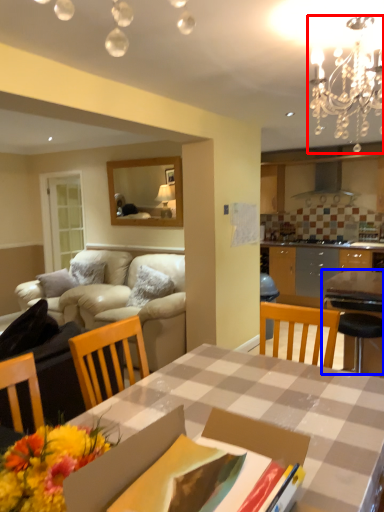
Question: Among these objects, which one is nearest to the camera, light fixture (highlighted by a red box) or table (highlighted by a blue box)?

Choices:
 (A) light fixture
 (B) table

Answer: (A)